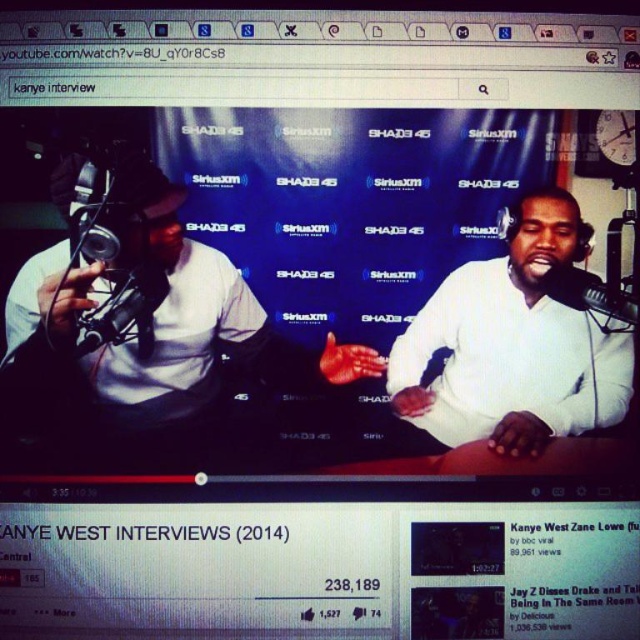
You are a graphic designer working on a project that requires precise placement of elements. You need to place a watermark on the image such that it does not cover any of the existing elements. The coordinates provided are in normalized image coordinates. Given the point at [513,344] marking the white matte shirt at right, can you determine if placing the watermark at coordinates 0.5, 0.8 would overlap with the white matte shirt at right?

The point at [513,344] marks the white matte shirt at right. Placing the watermark at 0.5, 0.8 would be slightly to the left and slightly lower than the marked point. However, without knowing the size of the watermark or the area occupied by the white matte shirt at right, it is impossible to definitively determine overlap. The question does not provide information about the dimensions of either the watermark or the shirt, so a precise answer cannot be given based on the provided data.

Looking at this image, you are a user navigating a YouTube page. You see two points on the screen. The first point is at coordinate point (596, 417) and the second point is at coordinate point (564, 300). Which point is closer to you?

Point (596, 417) is in front of point (564, 300), so the first point is closer to you.